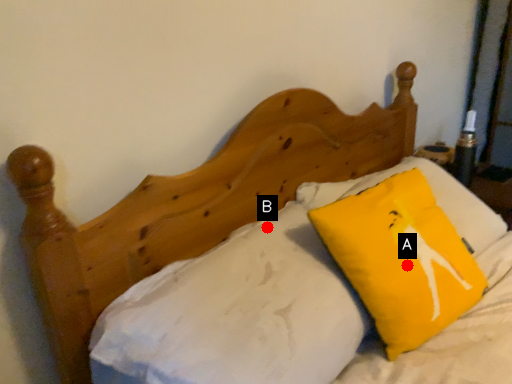
Question: Two points are circled on the image, labeled by A and B beside each circle. Which point is closer to the camera taking this photo?

Choices:
 (A) A is closer
 (B) B is closer

Answer: (A)